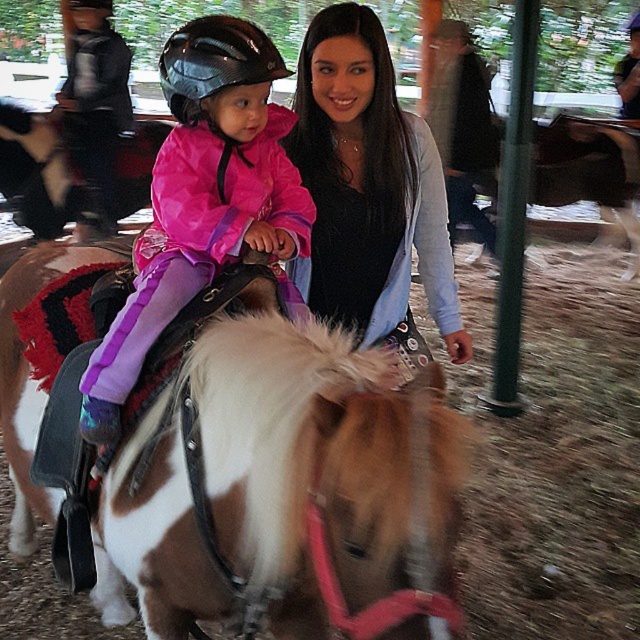
Question: Which point appears closest to the camera in this image?

Choices:
 (A) (99, 170)
 (B) (374, 134)
 (C) (17, 372)
 (D) (264, 64)

Answer: (D)

Question: Considering the real-world distances, which object is closest to the smooth black shirt at center?

Choices:
 (A) black glossy helmet at upper center
 (B) brushed metal helmet at upper left
 (C) brown and white speckled horse at center

Answer: (A)

Question: Does brown and white speckled horse at center have a greater width compared to brushed metal helmet at upper left?

Choices:
 (A) yes
 (B) no

Answer: (A)

Question: Can you confirm if pink matte jacket at upper left is positioned above black glossy helmet at upper center?

Choices:
 (A) yes
 (B) no

Answer: (B)

Question: Which point appears closest to the camera in this image?

Choices:
 (A) (240, 49)
 (B) (74, 129)

Answer: (A)

Question: Is brown and white speckled horse at center above pink matte jacket at upper left?

Choices:
 (A) no
 (B) yes

Answer: (A)